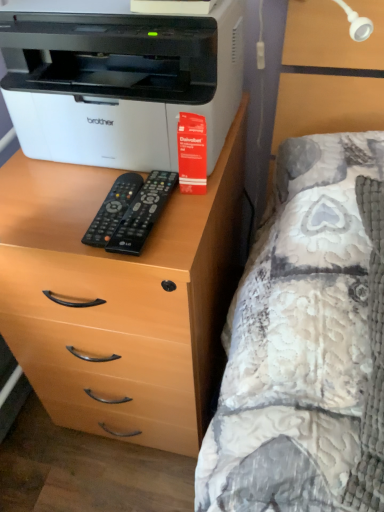
The image size is (384, 512). I want to click on free spot to the right of black plastic remote at center, the second remote viewed from the left, so click(191, 217).